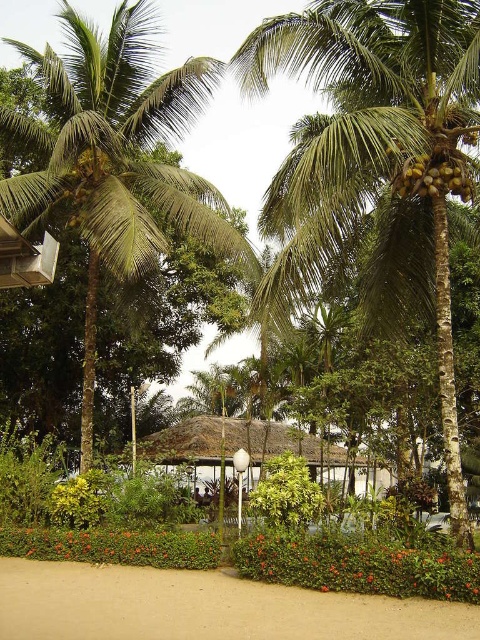
Does point (131, 83) come closer to viewer compared to point (325, 451)?

Yes, point (131, 83) is closer to viewer.

Is green leafy palm tree at center above thatched roof hut at center?

Indeed, green leafy palm tree at center is positioned over thatched roof hut at center.

Describe the element at coordinates (115, 157) in the screenshot. I see `green leafy palm tree at center` at that location.

You are a GUI agent. You are given a task and a screenshot of the screen. Output one action in this format:
    pyautogui.click(x=<x>, y=<y>)
    Task: Click on the green leafy palm tree at center
    This screenshot has width=480, height=640.
    Given the screenshot: What is the action you would take?
    pyautogui.click(x=115, y=157)

The height and width of the screenshot is (640, 480). Identify the location of sandy beach at lower center. (204, 608).

How far apart are sandy beach at lower center and thatched roof hut at center?

sandy beach at lower center is 39.36 feet away from thatched roof hut at center.

I want to click on sandy beach at lower center, so click(x=204, y=608).

Find the location of a particular element. This screenshot has height=640, width=480. sandy beach at lower center is located at coordinates (204, 608).

The width and height of the screenshot is (480, 640). What do you see at coordinates (375, 156) in the screenshot?
I see `green leafy coconut tree at center` at bounding box center [375, 156].

Which is above, green leafy coconut tree at center or thatched roof hut at center?

Positioned higher is green leafy coconut tree at center.

What do you see at coordinates (375, 156) in the screenshot? I see `green leafy coconut tree at center` at bounding box center [375, 156].

Where is `green leafy coconut tree at center`? green leafy coconut tree at center is located at coordinates (375, 156).